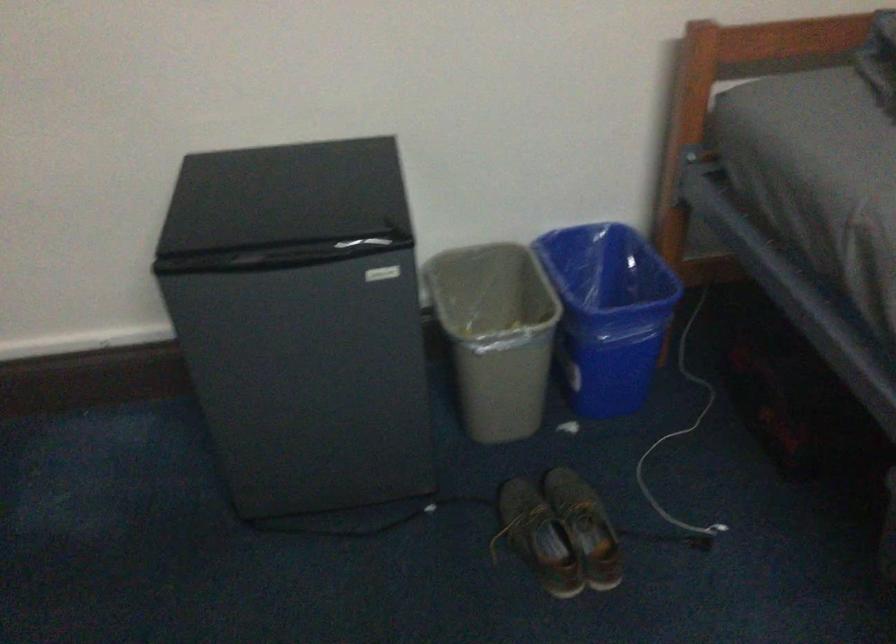
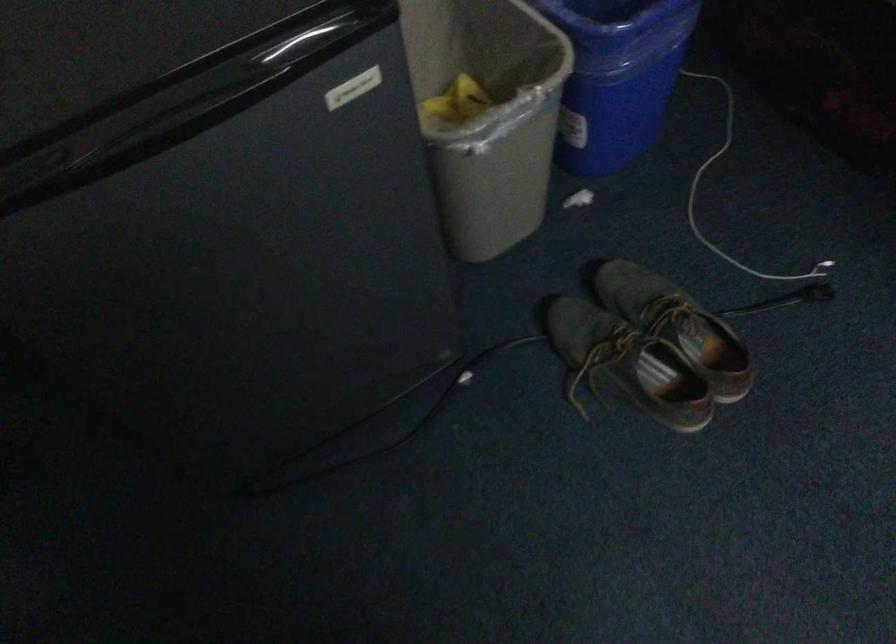
In the second image, find the point that corresponds to point 488,333 in the first image.

(487, 115)